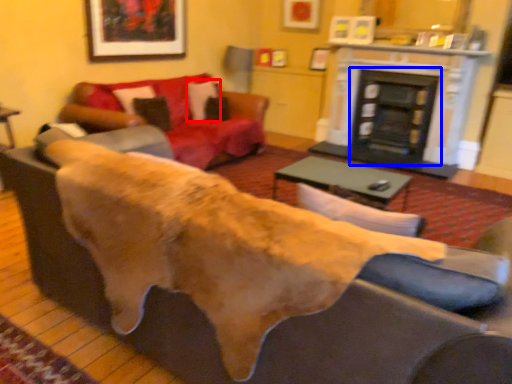
Question: Which object appears farthest to the camera in this image, pillow (highlighted by a red box) or fireplace (highlighted by a blue box)?

Choices:
 (A) pillow
 (B) fireplace

Answer: (B)